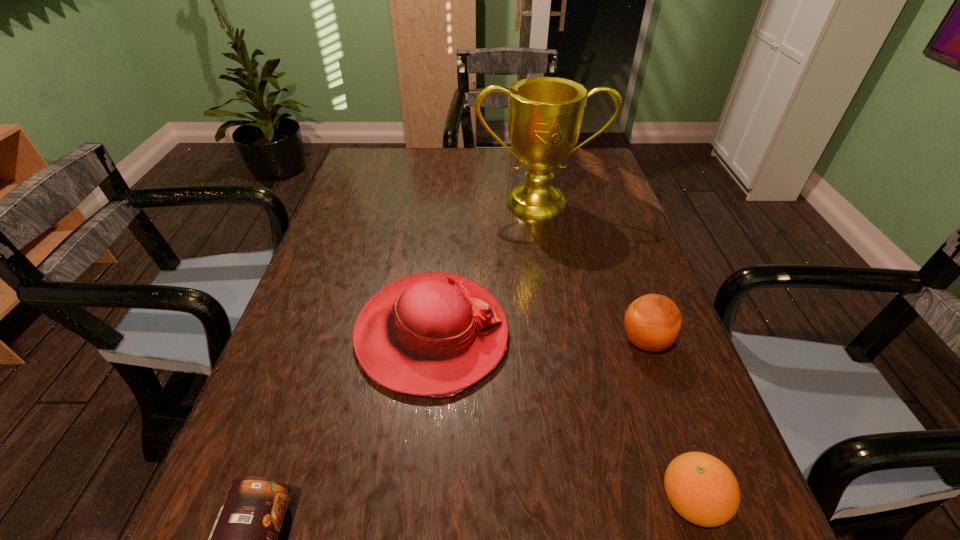
Where is `the farthest object`? the farthest object is located at coordinates (545, 114).

Locate an element on the screen. This screenshot has height=540, width=960. award is located at coordinates (545, 114).

Where is `hat`? hat is located at coordinates (433, 334).

Where is `the farther orange`? The height and width of the screenshot is (540, 960). the farther orange is located at coordinates (652, 322).

I want to click on the nearer orange, so click(x=702, y=489).

This screenshot has height=540, width=960. I want to click on free space located 0.110m on the shiny surface of the farthest object, so click(x=546, y=248).

This screenshot has width=960, height=540. What are the coordinates of `free space located 0.150m at the front of the hat with a bow` in the screenshot? It's located at (580, 334).

I want to click on free space located 0.330m on the back of the farther orange, so click(606, 230).

Find the location of a particular element. vacant space situated 0.300m on the left of the nearer orange is located at coordinates (466, 501).

Where is `object present at the near edge`? object present at the near edge is located at coordinates (702, 489).